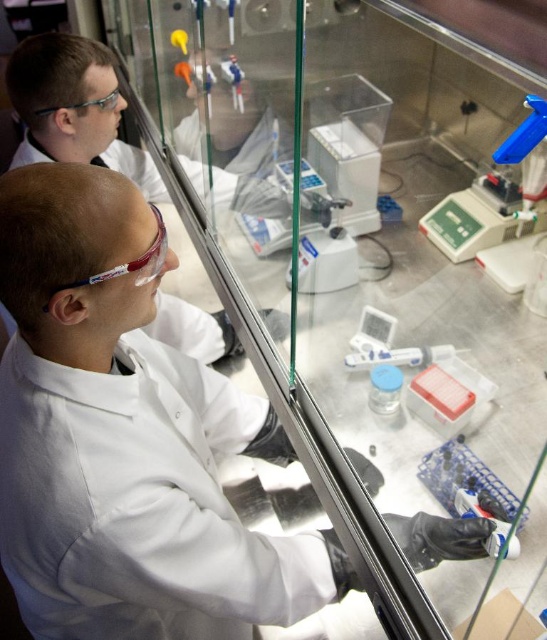
Question: Estimate the real-world distances between objects in this image. Which object is closer to the transparent plastic goggles at upper left?

Choices:
 (A) transparent plastic glasses at upper left
 (B) white lab coat at upper left

Answer: (A)

Question: Among these objects, which one is nearest to the camera?

Choices:
 (A) transparent plastic goggles at upper left
 (B) white lab coat at upper left

Answer: (A)

Question: Which point is farther from the camera taking this photo?

Choices:
 (A) (91, 275)
 (B) (107, 106)
 (C) (195, 182)

Answer: (C)

Question: Can you confirm if transparent plastic goggles at upper left is bigger than transparent plastic glasses at upper left?

Choices:
 (A) no
 (B) yes

Answer: (A)

Question: Can you confirm if white lab coat at upper left is positioned below transparent plastic goggles at upper left?

Choices:
 (A) yes
 (B) no

Answer: (B)

Question: Where is white lab coat at upper left located in relation to transparent plastic glasses at upper left in the image?

Choices:
 (A) above
 (B) below

Answer: (B)